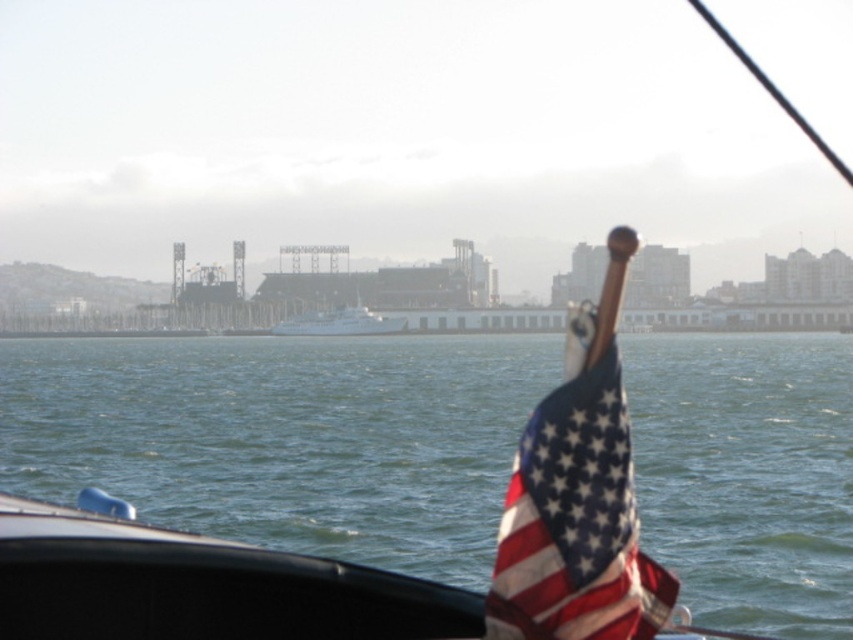
Question: Which point is farther from the camera taking this photo?

Choices:
 (A) (352, 323)
 (B) (608, 362)

Answer: (A)

Question: Can you confirm if american flag at right is positioned to the right of white glossy boat at center?

Choices:
 (A) no
 (B) yes

Answer: (B)

Question: Which object is the closest to the american flag at right?

Choices:
 (A) white glossy boat at center
 (B) green water at lower center

Answer: (B)

Question: Does green water at lower center have a greater width compared to american flag at right?

Choices:
 (A) yes
 (B) no

Answer: (A)

Question: Does green water at lower center have a lesser width compared to american flag at right?

Choices:
 (A) yes
 (B) no

Answer: (B)

Question: Which object appears closest to the camera in this image?

Choices:
 (A) green water at lower center
 (B) white glossy boat at center
 (C) american flag at right

Answer: (C)